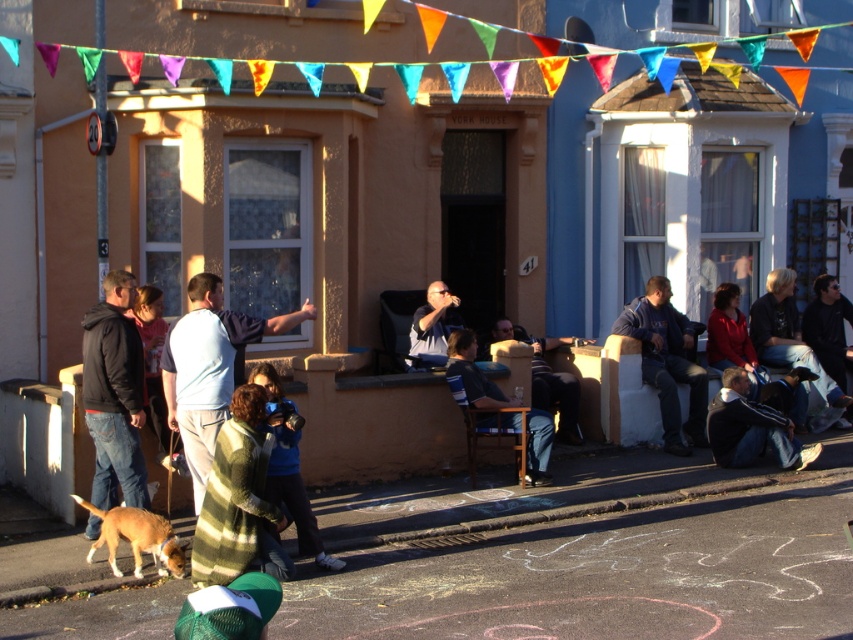
Question: Does dark blue jeans at lower right appear on the left side of dark blue sweater at center?

Choices:
 (A) yes
 (B) no

Answer: (B)

Question: Is dark blue jeans at lower right to the left of dark blue shirt at center from the viewer's perspective?

Choices:
 (A) no
 (B) yes

Answer: (A)

Question: Considering the relative positions of dark blue shirt at center and blue fabric shirt at center in the image provided, where is dark blue shirt at center located with respect to blue fabric shirt at center?

Choices:
 (A) above
 (B) below

Answer: (B)

Question: Which of the following is the closest to the observer?

Choices:
 (A) (125, 278)
 (B) (178, 580)
 (C) (210, 550)
 (D) (433, 332)

Answer: (C)

Question: Which point is closer to the camera?

Choices:
 (A) dark blue sweater at center
 (B) smooth asphalt pavement at lower center

Answer: (B)

Question: Which object is farther from the camera taking this photo?

Choices:
 (A) dark blue hoodie at left
 (B) dark blue jeans at lower right
 (C) light blue shirt at center

Answer: (B)